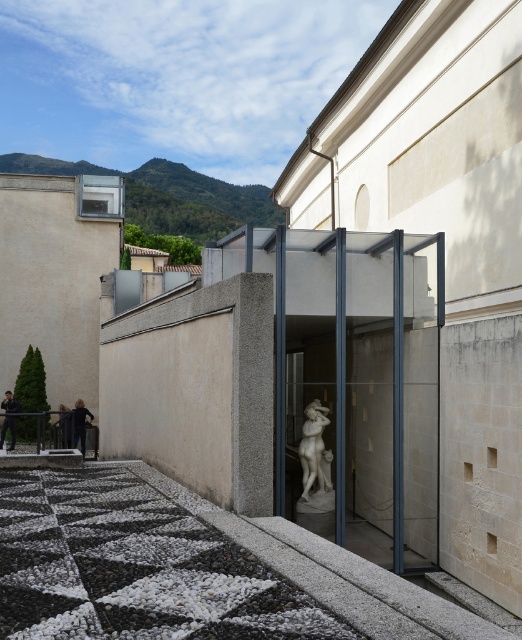
Question: Based on their relative distances, which object is farther from the polished marble statue at center?

Choices:
 (A) dark blue fabric at lower left
 (B) dark blue leather jacket at lower left

Answer: (B)

Question: Is dark blue fabric at lower left to the left of dark brown leather jacket at lower left from the viewer's perspective?

Choices:
 (A) no
 (B) yes

Answer: (A)

Question: Which of the following is the closest to the observer?

Choices:
 (A) dark blue fabric at lower left
 (B) dark blue leather jacket at lower left

Answer: (A)

Question: Does dark blue leather jacket at lower left have a lesser width compared to dark brown leather jacket at lower left?

Choices:
 (A) yes
 (B) no

Answer: (B)

Question: Among these points, which one is nearest to the camera?

Choices:
 (A) (63, 440)
 (B) (10, 396)
 (C) (328, 481)
 (D) (76, 433)

Answer: (C)

Question: Is dark blue leather jacket at lower left thinner than dark blue fabric at lower left?

Choices:
 (A) yes
 (B) no

Answer: (B)